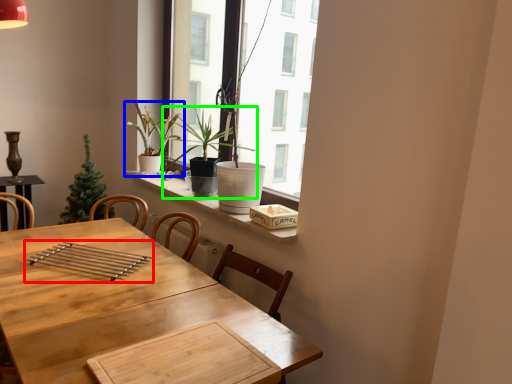
Question: Which object is the farthest from silverware (highlighted by a red box)? Choose among these: houseplant (highlighted by a blue box) or houseplant (highlighted by a green box).

Choices:
 (A) houseplant
 (B) houseplant

Answer: (A)